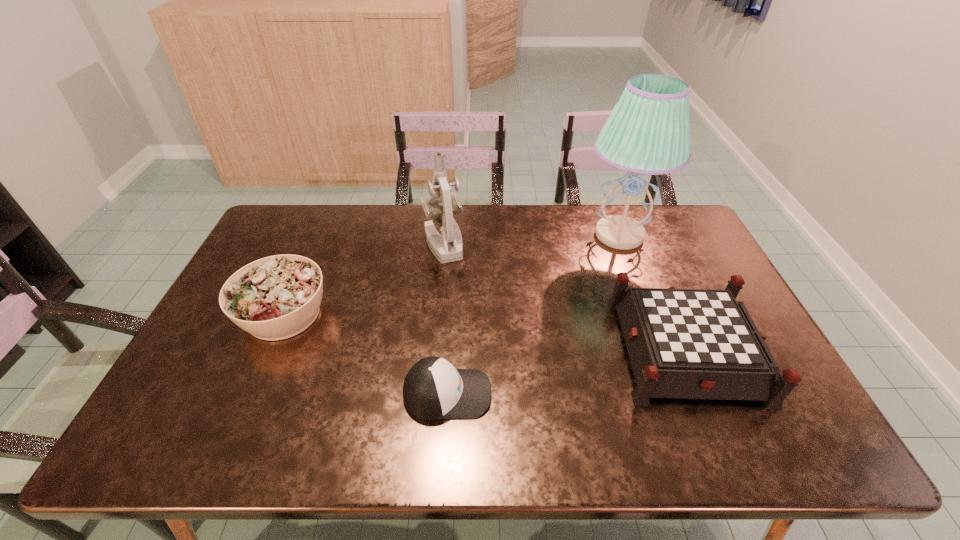
Locate an element on the screen. The image size is (960, 540). lamp is located at coordinates (648, 132).

Locate an element on the screen. The height and width of the screenshot is (540, 960). microscope is located at coordinates (448, 247).

This screenshot has height=540, width=960. Identify the location of salad. (277, 297).

Where is `checkerboard`? checkerboard is located at coordinates (682, 343).

Locate an element on the screen. The image size is (960, 540). the shortest object is located at coordinates (433, 389).

You are a GUI agent. You are given a task and a screenshot of the screen. Output one action in this format:
    pyautogui.click(x=<x>, y=<y>)
    Task: Click on the blank space located on the left of the lamp
    Image resolution: width=960 pixels, height=540 pixels.
    Given the screenshot: What is the action you would take?
    pyautogui.click(x=534, y=235)

Identify the location of blank area located on the left of the second tallest object. (317, 244).

The image size is (960, 540). What are the coordinates of `free point located 0.250m on the back of the leftmost object` in the screenshot? It's located at (319, 233).

Where is `free space located on the back of the checkerboard`? Image resolution: width=960 pixels, height=540 pixels. free space located on the back of the checkerboard is located at coordinates (648, 259).

At what (x,y) coordinates should I click in order to perform the action: click on blank space located on the front panel of the cap. Please return your answer as a coordinate pair (x, y). The image size is (960, 540). Looking at the image, I should click on (613, 394).